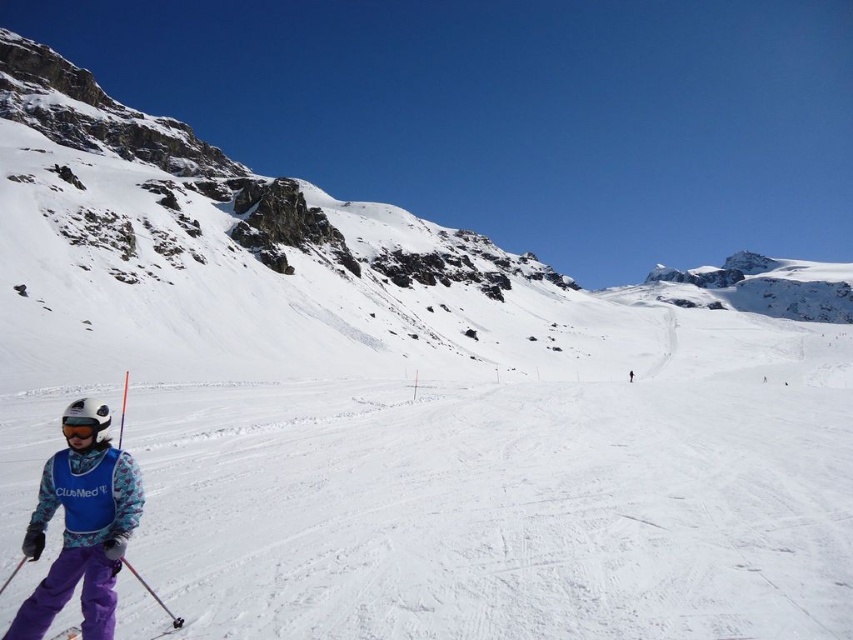
Consider the image. Does white matte goggles at lower left appear on the right side of purple fabric ski at lower left?

In fact, white matte goggles at lower left is to the left of purple fabric ski at lower left.

Identify the location of white matte goggles at lower left. (82, 428).

Which is in front, point (74, 426) or point (78, 630)?

Positioned in front is point (78, 630).

This screenshot has width=853, height=640. Find the location of `white matte goggles at lower left`. white matte goggles at lower left is located at coordinates (82, 428).

Who is positioned more to the left, purple fabric ski suit at lower left or white matte goggles at lower left?

white matte goggles at lower left

Who is more distant from viewer, (114,620) or (90,435)?

Point (90,435)

In order to click on purple fabric ski suit at lower left in this screenshot , I will do `click(80, 536)`.

Does purple fabric ski suit at lower left come in front of purple fabric ski at lower left?

Yes, it is.

This screenshot has width=853, height=640. Describe the element at coordinates (80, 536) in the screenshot. I see `purple fabric ski suit at lower left` at that location.

Is point (102, 451) more distant than point (76, 628)?

That is True.

Identify the location of purple fabric ski suit at lower left. (80, 536).